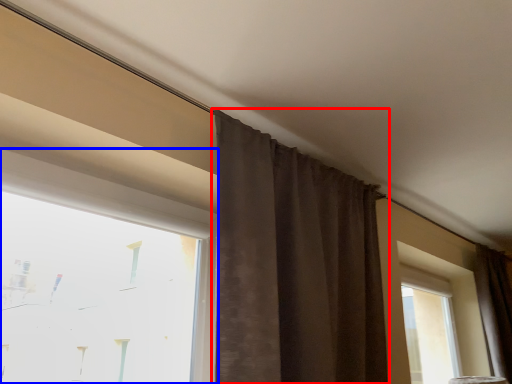
Question: Which object appears closest to the camera in this image, curtain (highlighted by a red box) or window (highlighted by a blue box)?

Choices:
 (A) curtain
 (B) window

Answer: (B)